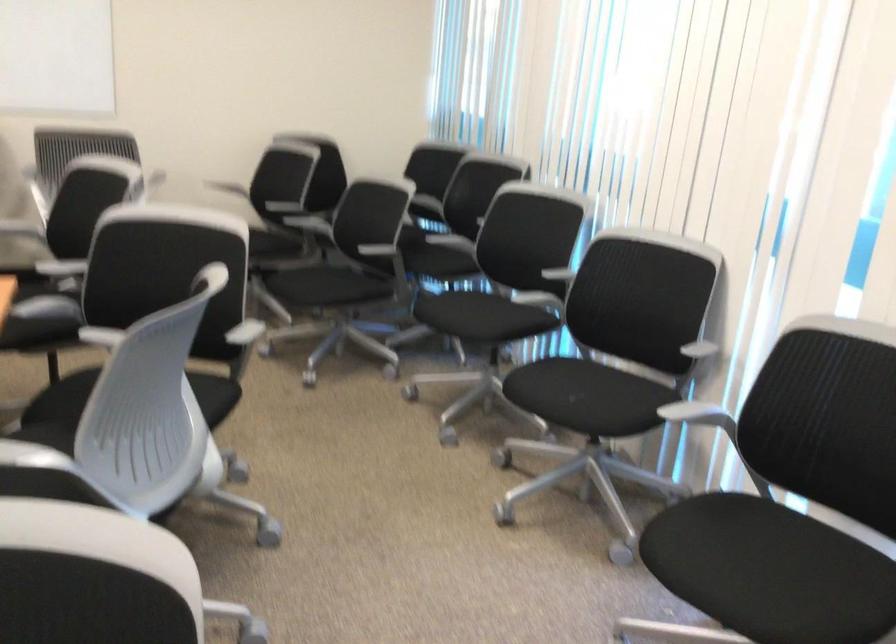
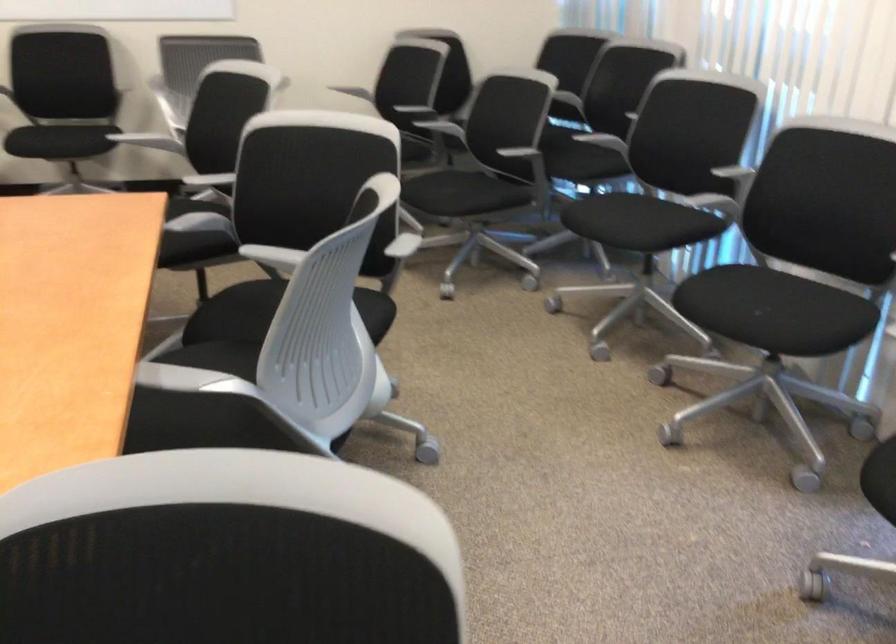
Find the pixel in the second image that matches pixel 584 402 in the first image.

(771, 310)